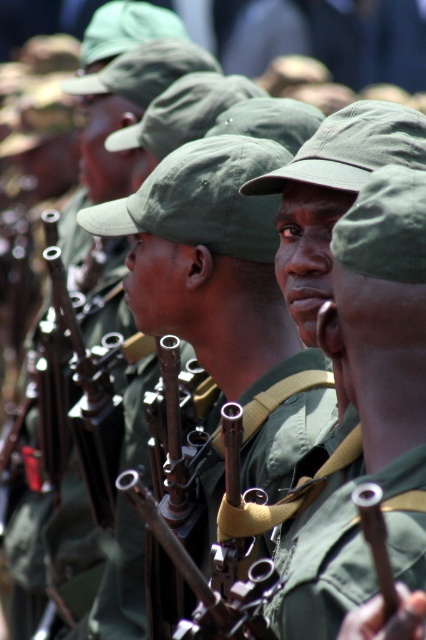
Is matte green uniform at center thinner than green fabric uniform at center?

No.

Can you confirm if matte green uniform at center is positioned to the right of green fabric uniform at center?

Yes, matte green uniform at center is to the right of green fabric uniform at center.

Locate an element on the screen. This screenshot has height=640, width=426. matte green uniform at center is located at coordinates (363, 397).